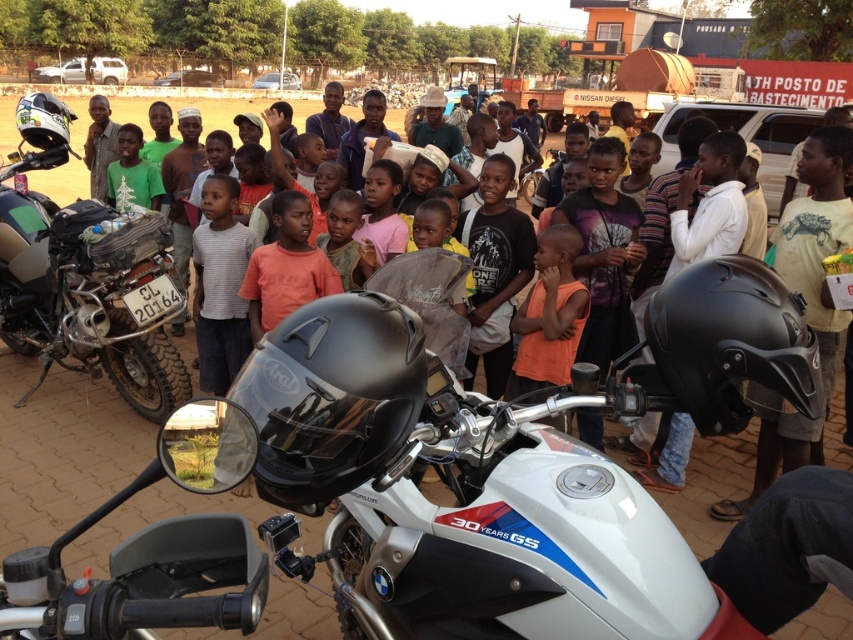
Question: Which object is the farthest from the orange matte shirt at center?

Choices:
 (A) matte black motorcycle at left
 (B) light brown skin at center
 (C) white matte motorcycle at center

Answer: (C)

Question: Is white matte motorcycle at center to the right of matte black motorcycle at left from the viewer's perspective?

Choices:
 (A) yes
 (B) no

Answer: (A)

Question: Which object is the closest to the orange matte shirt at center?

Choices:
 (A) white matte motorcycle at center
 (B) matte black motorcycle at left

Answer: (B)

Question: Can you confirm if white matte motorcycle at center is bigger than orange matte shirt at center?

Choices:
 (A) yes
 (B) no

Answer: (A)

Question: Estimate the real-world distances between objects in this image. Which object is closer to the white matte motorcycle at center?

Choices:
 (A) light brown skin at center
 (B) matte black motorcycle at left
 (C) orange matte shirt at center

Answer: (C)

Question: Is orange matte shirt at center smaller than light brown skin at center?

Choices:
 (A) yes
 (B) no

Answer: (B)